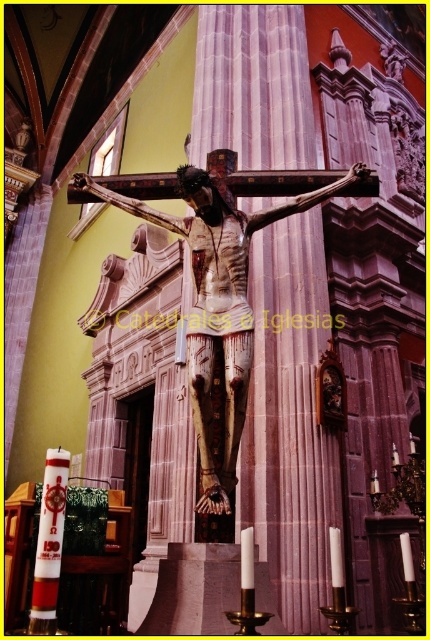
You are standing in the church and want to take a photo of the wooden crucifix at center. The camera you are using has a focus point at coordinates (218, 305). Will the crucifix be in focus?

The wooden crucifix at center is located at point (218, 305), so the camera focus point is exactly at the crucifix location, meaning the crucifix will be in focus.

You are a visitor standing in the church and want to light the white glossy candle at lower left. The wooden crucifix at center is blocking your path. Can you walk around it to reach the candle?

The wooden crucifix at center and white glossy candle at lower left are 14.06 meters apart from each other. Since the crucifix is blocking your path, you can walk around it to reach the candle as there is enough space between them.

You are standing in the church and want to light the white glossy candle at lower left. The wooden crucifix at center is in your way. Can you light the candle without moving the crucifix?

The wooden crucifix at center is above the white glossy candle at lower left, so you can light the candle without moving the crucifix because it is positioned above and does not block access.